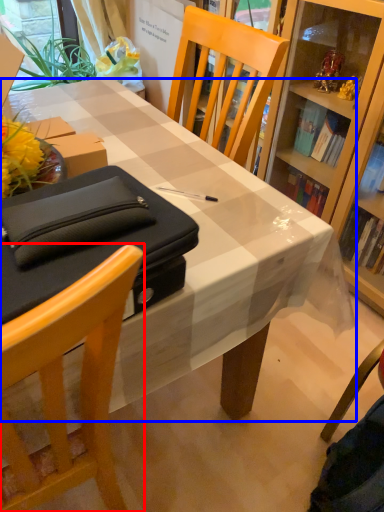
Question: Which of the following is the closest to the observer, chair (highlighted by a red box) or desk (highlighted by a blue box)?

Choices:
 (A) chair
 (B) desk

Answer: (A)